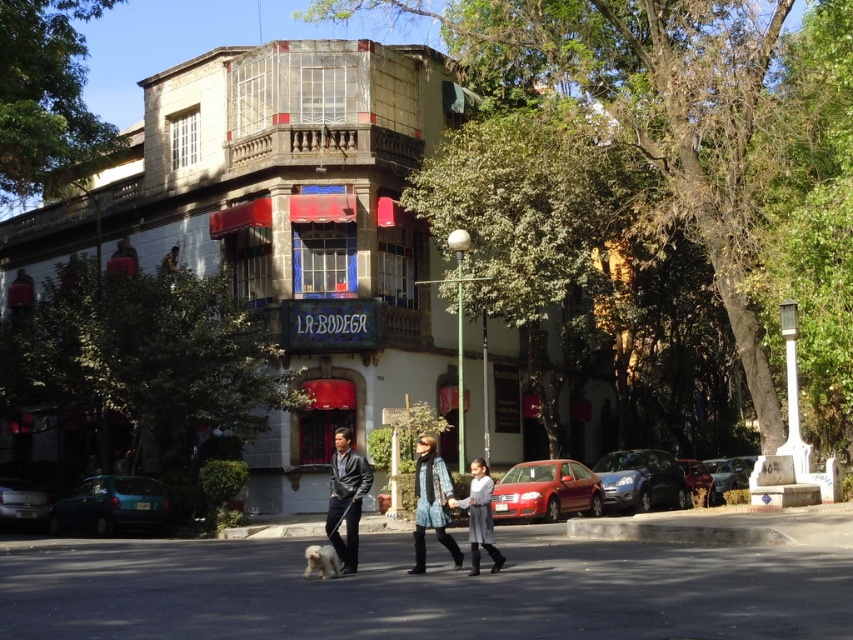
You are a delivery person trying to park your bike on the street in front of LA BODEGA. You need to know if there is enough space between the black asphalt pavement at center and the white fur dog at lower center to park your bike. The bike requires 1.2 meters of space. Can you park there?

The black asphalt pavement at center has a larger width than the white fur dog at lower center. However, the exact width of the pavement isn not provided, so it is uncertain if it meets the 1.2 meters requirement for parking the bike.